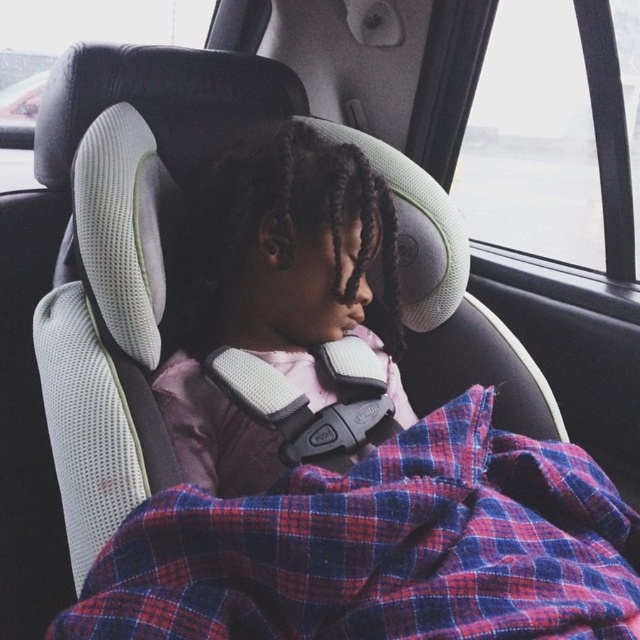
Question: Is plaid fabric at center wider than matte pink fabric at center?

Choices:
 (A) yes
 (B) no

Answer: (A)

Question: Does plaid fabric at center lie behind matte pink fabric at center?

Choices:
 (A) yes
 (B) no

Answer: (B)

Question: Is plaid fabric at center positioned in front of matte pink fabric at center?

Choices:
 (A) no
 (B) yes

Answer: (B)